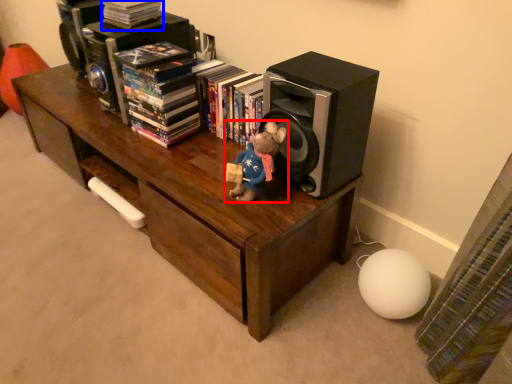
Question: Which point is further to the camera, toy (highlighted by a red box) or book (highlighted by a blue box)?

Choices:
 (A) toy
 (B) book

Answer: (B)